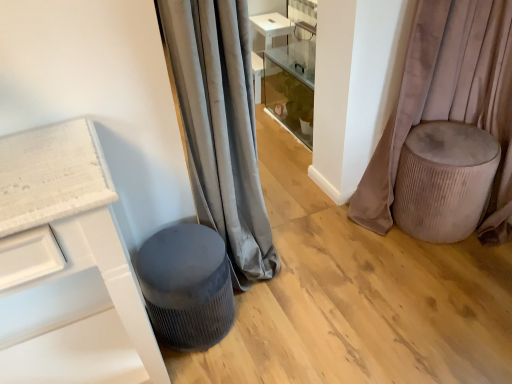
Where is `vacant region in front of gray velvet curtain at center, which is the 1th curtain from left to right`? This screenshot has height=384, width=512. vacant region in front of gray velvet curtain at center, which is the 1th curtain from left to right is located at coordinates (281, 324).